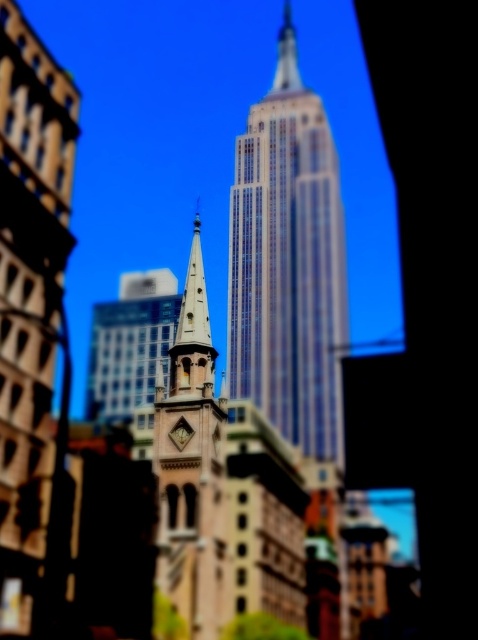
You are a photographer planning to capture both the glassy steel skyscraper at center and the beige stone clock tower at center in a single frame. Given their spatial arrangement, which building should you position closer to the edge of your camera frame to include both structures without cropping either?

The glassy steel skyscraper at center is positioned on the right side of the beige stone clock tower at center. To include both in the frame without cropping, you should position the glassy steel skyscraper at center closer to the right edge of the camera frame and the beige stone clock tower at center closer to the left edge.

You are standing in the city and see the point marked at coordinates (288, 262). Based on the scene, what does this point likely represent?

The point at (288, 262) indicates the glassy steel skyscraper at center, which is the Empire State Building.